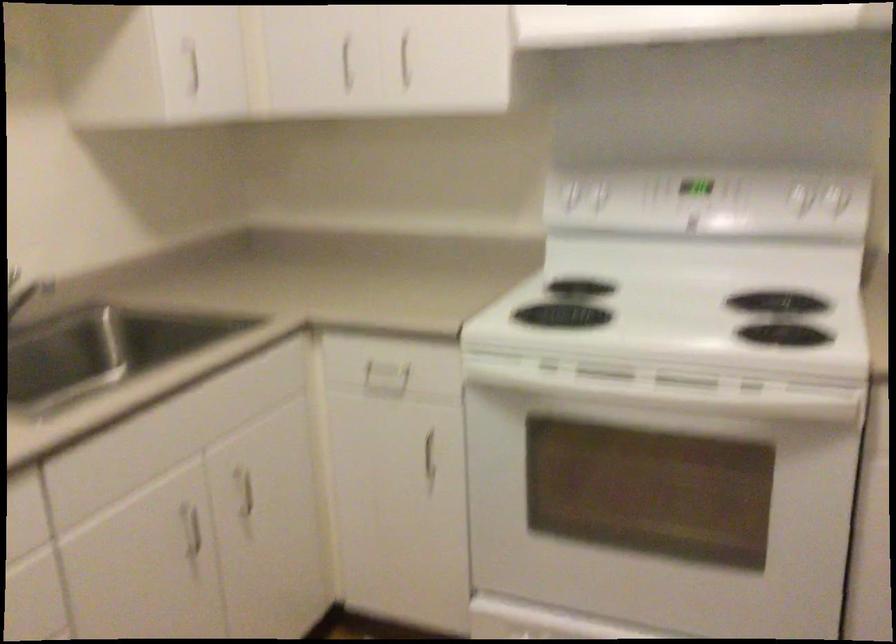
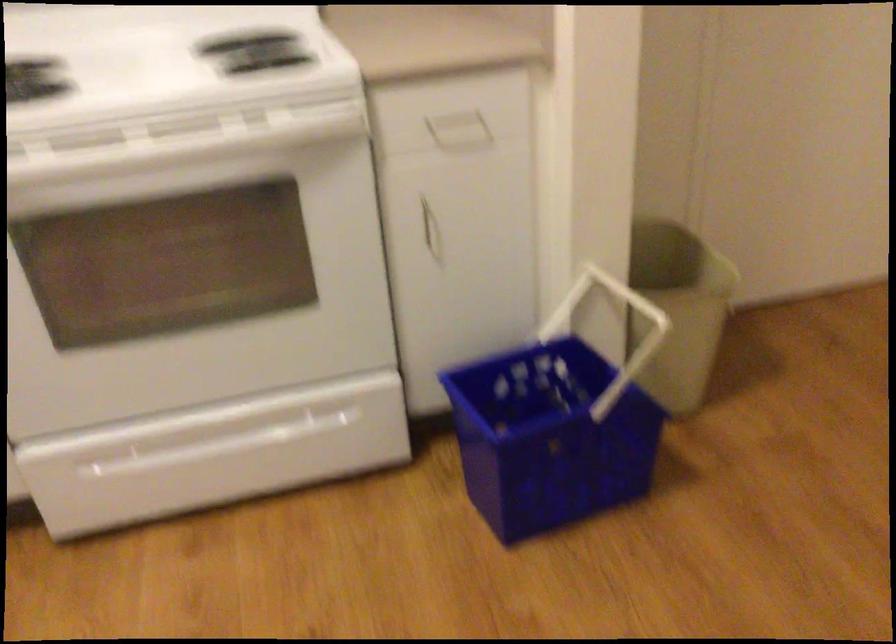
The point at (676, 392) is marked in the first image. Where is the corresponding point in the second image?

(175, 143)